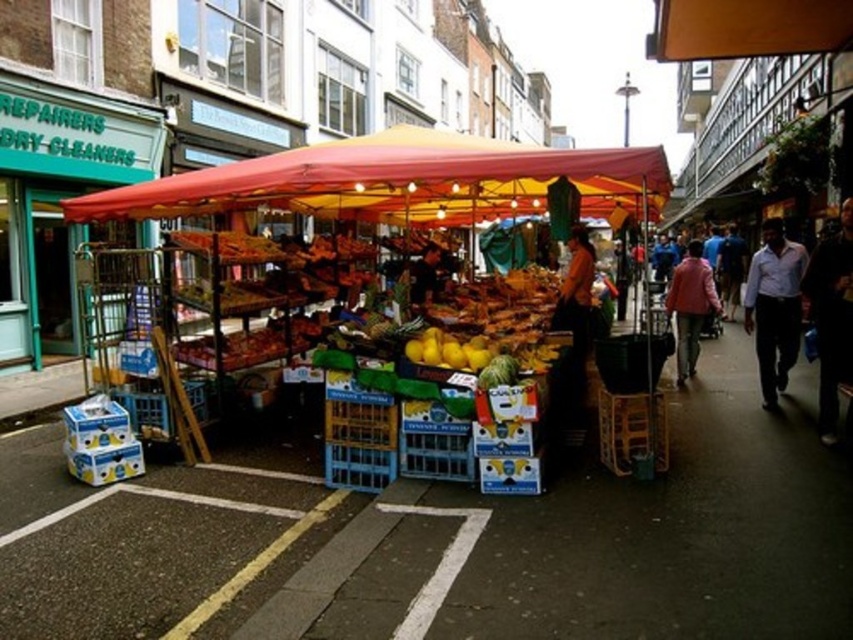
Question: Does matte plastic fruit stand at center appear under red fabric canopy at center?

Choices:
 (A) yes
 (B) no

Answer: (A)

Question: Which of the following is the closest to the observer?

Choices:
 (A) (592, 196)
 (B) (691, 358)
 (C) (776, 339)

Answer: (C)

Question: Which object appears farthest from the camera in this image?

Choices:
 (A) dark blue jeans at lower right
 (B) yellow matte lemons at center
 (C) matte plastic fruit stand at center

Answer: (A)

Question: Does matte plastic fruit stand at center appear under pink fabric jacket at center-right?

Choices:
 (A) yes
 (B) no

Answer: (B)

Question: Which of the following is the closest to the observer?

Choices:
 (A) (689, 326)
 (B) (318, 177)
 (C) (399, 176)

Answer: (C)

Question: Considering the relative positions of red fabric canopy at center and yellow matte lemons at center in the image provided, where is red fabric canopy at center located with respect to yellow matte lemons at center?

Choices:
 (A) right
 (B) left

Answer: (B)